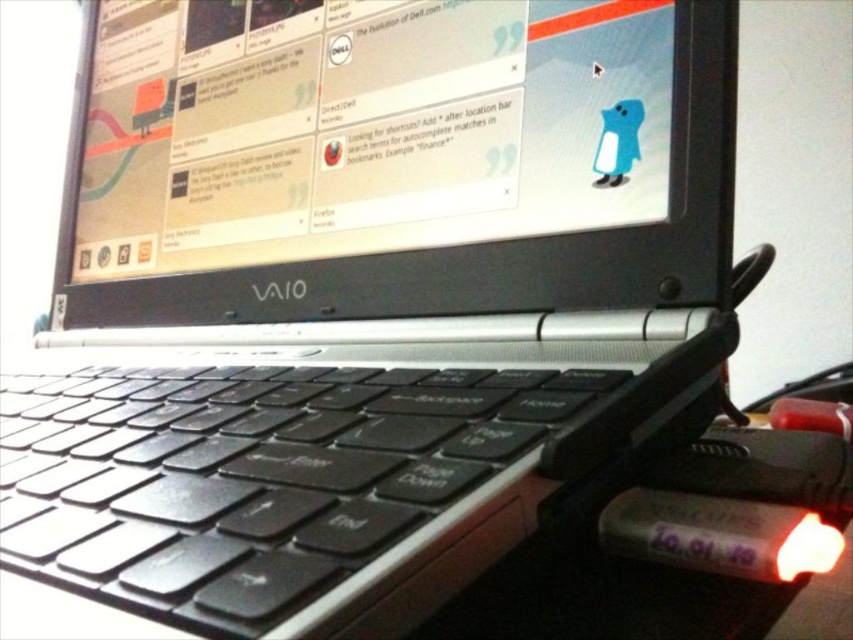
You are setting up a workspace and need to place the matte black laptop at center and the black matte keyboard at center on a desk. If the desk has a width limit of 50 cm, can both items fit side by side without overlapping?

The matte black laptop at center is wider than the black matte keyboard at center. However, since the desk has a 50 cm width limit, we need to know their exact dimensions to determine if they can fit side by side. Unfortunately, the provided information does not include the specific widths of either item, so we cannot confirm if they will fit without overlapping.